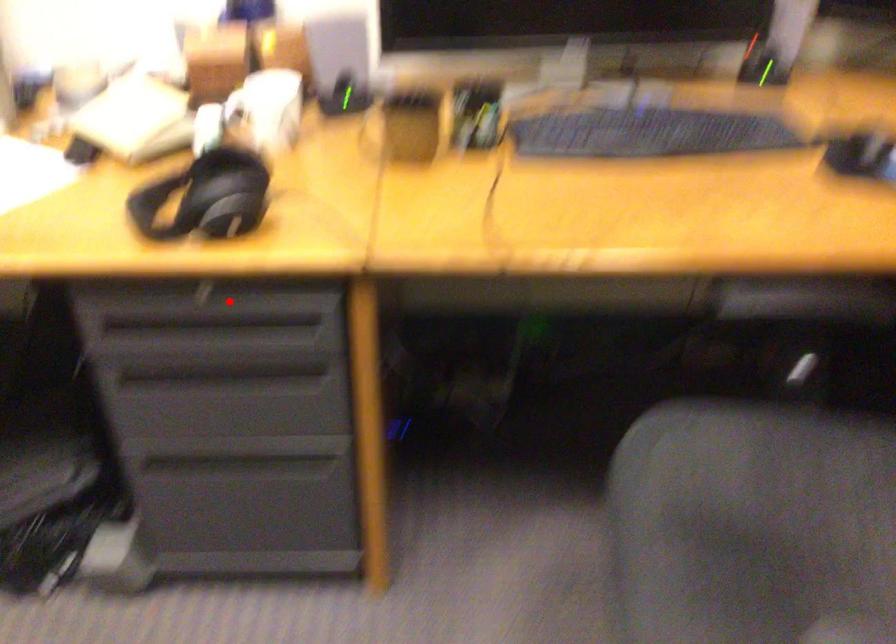
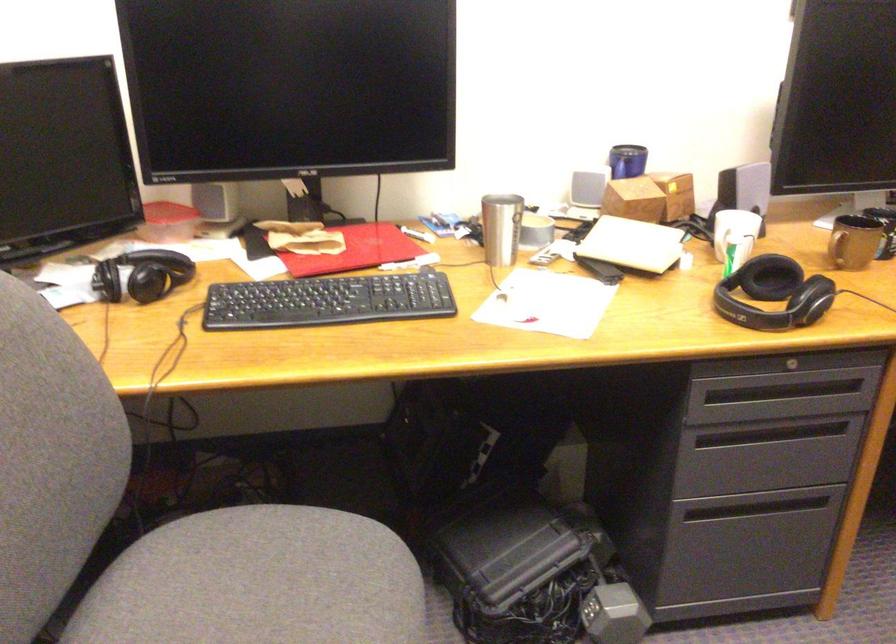
Locate, in the second image, the point that corresponds to the highlighted location in the first image.

(794, 365)